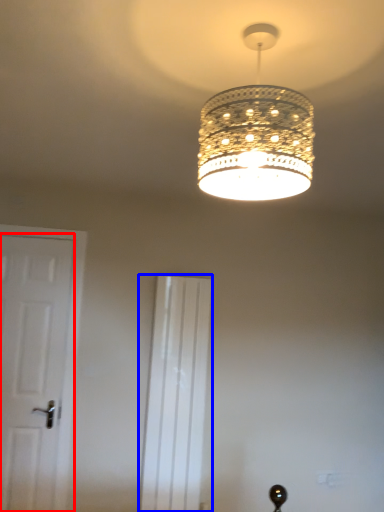
Question: Which object is closer to the camera taking this photo, door (highlighted by a red box) or screen door (highlighted by a blue box)?

Choices:
 (A) door
 (B) screen door

Answer: (A)